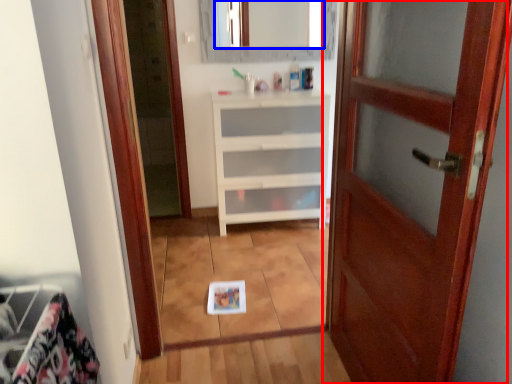
Question: Which object is closer to the camera taking this photo, door (highlighted by a red box) or mirror (highlighted by a blue box)?

Choices:
 (A) door
 (B) mirror

Answer: (A)